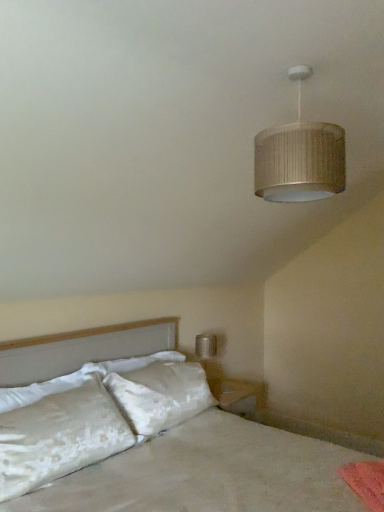
Question: Is matte silver lampshade at upper right wider or thinner than white soft pillow at left, the first pillow when ordered from top to bottom?

Choices:
 (A) wide
 (B) thin

Answer: (A)

Question: In terms of height, does matte silver lampshade at upper right look taller or shorter compared to white soft pillow at left, the first pillow when ordered from top to bottom?

Choices:
 (A) short
 (B) tall

Answer: (B)

Question: Which of these objects is positioned closest to the matte silver lampshade at upper right?

Choices:
 (A) white soft pillow at left, the second pillow in the bottom-to-top sequence
 (B) white velvety pillow at lower left, the 1th pillow in the bottom-to-top sequence
 (C) white satin bed at lower left

Answer: (C)

Question: Estimate the real-world distances between objects in this image. Which object is farther from the white velvety pillow at lower left, the 1th pillow in the bottom-to-top sequence?

Choices:
 (A) white soft pillow at left, the second pillow in the bottom-to-top sequence
 (B) white satin bed at lower left
 (C) matte silver lampshade at upper right

Answer: (C)